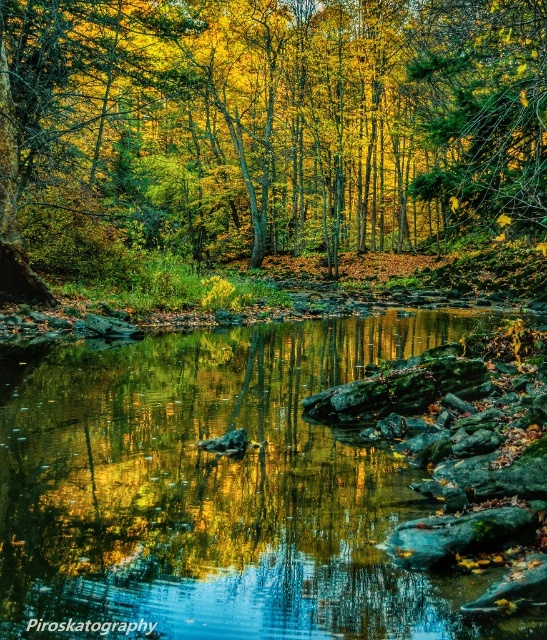
Question: Which point is closer to the camera?

Choices:
 (A) golden leafy tree at center
 (B) green mossy rocks at center

Answer: (B)

Question: Is golden leafy tree at center below green mossy rocks at center?

Choices:
 (A) yes
 (B) no

Answer: (B)

Question: Is golden leafy tree at center smaller than green mossy rocks at center?

Choices:
 (A) yes
 (B) no

Answer: (B)

Question: Can you confirm if golden leafy tree at center is thinner than green mossy rocks at center?

Choices:
 (A) no
 (B) yes

Answer: (A)

Question: Which point is closer to the camera taking this photo?

Choices:
 (A) (538, 26)
 (B) (71, 508)

Answer: (B)